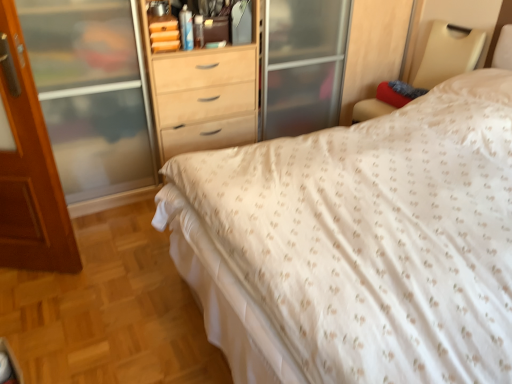
Question: Does matte wood dresser at center have a greater width compared to brown wooden door at left?

Choices:
 (A) no
 (B) yes

Answer: (B)

Question: Is matte wood dresser at center not within brown wooden door at left?

Choices:
 (A) yes
 (B) no

Answer: (A)

Question: Is matte wood dresser at center thinner than brown wooden door at left?

Choices:
 (A) yes
 (B) no

Answer: (B)

Question: Are matte wood dresser at center and brown wooden door at left located far from each other?

Choices:
 (A) no
 (B) yes

Answer: (B)

Question: From the image's perspective, is matte wood dresser at center on brown wooden door at left?

Choices:
 (A) no
 (B) yes

Answer: (B)

Question: In the image, is matte wood dresser at center on the left side or the right side of white textured bed at center?

Choices:
 (A) left
 (B) right

Answer: (A)

Question: From the image's perspective, is matte wood dresser at center above or below white textured bed at center?

Choices:
 (A) above
 (B) below

Answer: (A)

Question: From a real-world perspective, is matte wood dresser at center physically located above or below white textured bed at center?

Choices:
 (A) below
 (B) above

Answer: (B)

Question: Considering their positions, is matte wood dresser at center located in front of or behind white textured bed at center?

Choices:
 (A) behind
 (B) front

Answer: (A)

Question: Is point (359, 117) positioned closer to the camera than point (215, 84)?

Choices:
 (A) farther
 (B) closer

Answer: (A)

Question: Based on their sizes in the image, would you say white fabric bed frame at upper right is bigger or smaller than matte wood dresser at center?

Choices:
 (A) small
 (B) big

Answer: (A)

Question: Is white fabric bed frame at upper right taller or shorter than matte wood dresser at center?

Choices:
 (A) tall
 (B) short

Answer: (B)

Question: In terms of width, does white fabric bed frame at upper right look wider or thinner when compared to matte wood dresser at center?

Choices:
 (A) thin
 (B) wide

Answer: (A)

Question: In the image, is white fabric bed frame at upper right on the left side or the right side of white textured bed at center?

Choices:
 (A) left
 (B) right

Answer: (B)

Question: From a real-world perspective, is white fabric bed frame at upper right above or below white textured bed at center?

Choices:
 (A) above
 (B) below

Answer: (A)